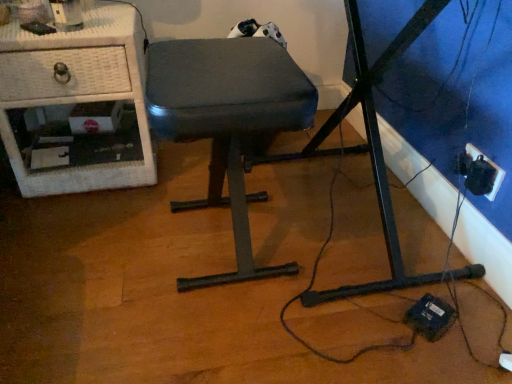
Locate an element on the screen. The height and width of the screenshot is (384, 512). vacant space that is in between white wicker nightstand at left and dark gray fabric stool at center is located at coordinates (x=131, y=211).